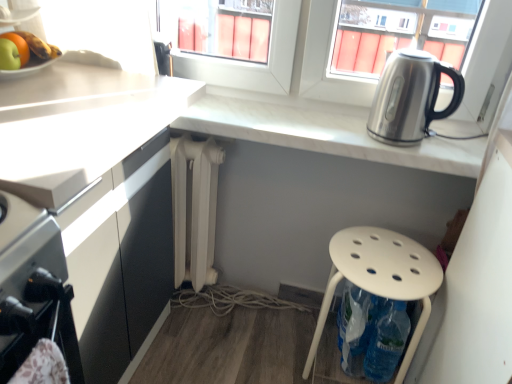
At what (x,y) coordinates should I click in order to perform the action: click on free point above white plastic stool at lower right (from a real-world perspective). Please return your answer as a coordinate pair (x, y). The width and height of the screenshot is (512, 384). Looking at the image, I should click on (384, 254).